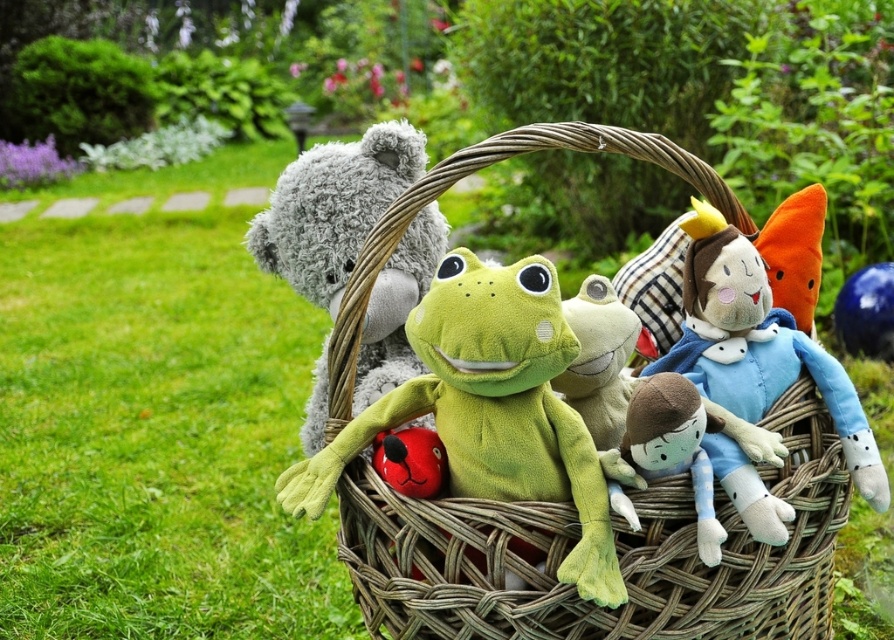
You are standing in a garden and see the woven wicker basket at center. Can you determine its exact location in terms of coordinates?

The woven wicker basket at center is located at point (616,550).